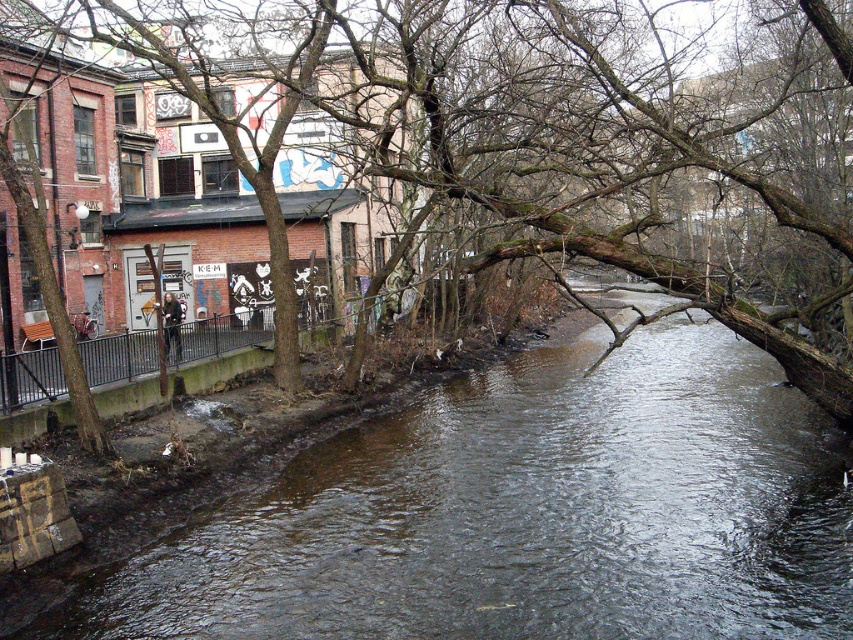
Question: Does brown/rough concrete stream at center have a smaller size compared to brown rough tree trunk at center?

Choices:
 (A) yes
 (B) no

Answer: (A)

Question: Which of the following is the closest to the observer?

Choices:
 (A) brown rough tree trunk at center
 (B) brown/rough concrete stream at center

Answer: (B)

Question: Considering the relative positions of brown/rough concrete stream at center and brown rough tree trunk at center in the image provided, where is brown/rough concrete stream at center located with respect to brown rough tree trunk at center?

Choices:
 (A) below
 (B) above

Answer: (A)

Question: Can you confirm if brown/rough concrete stream at center is bigger than brown rough tree trunk at center?

Choices:
 (A) no
 (B) yes

Answer: (A)

Question: Among these objects, which one is nearest to the camera?

Choices:
 (A) brown/rough concrete stream at center
 (B) brown rough tree trunk at center

Answer: (A)